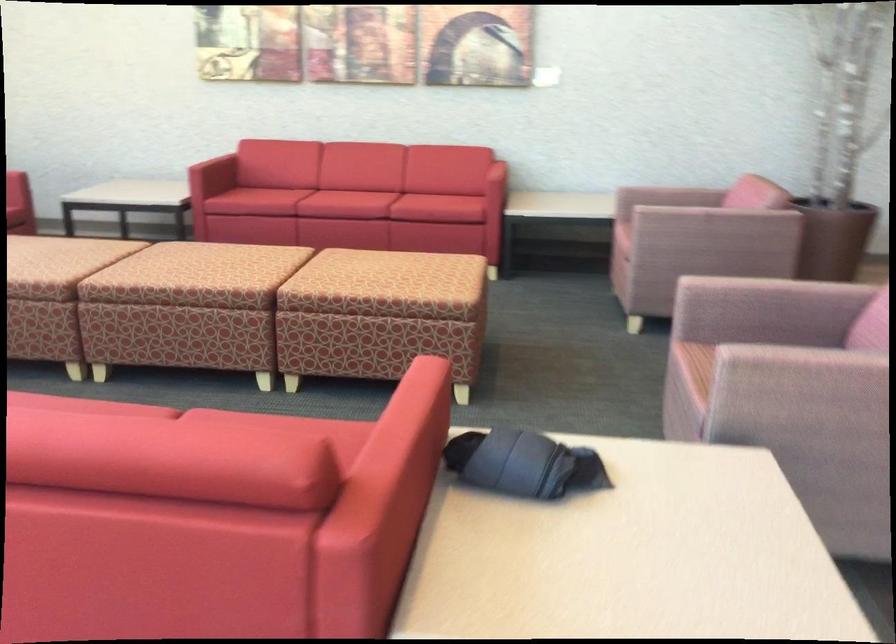
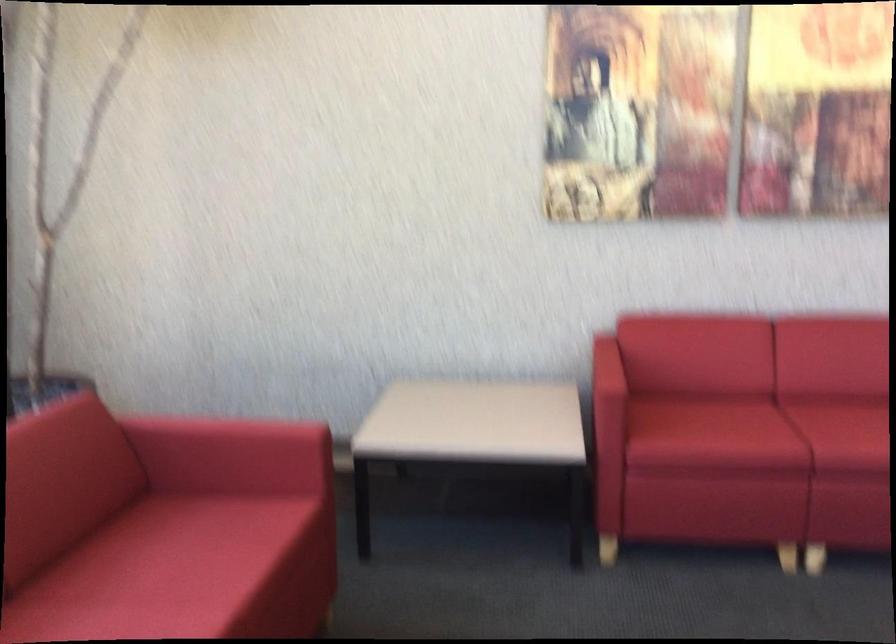
Where in the second image is the point corresponding to (x=277, y=176) from the first image?

(757, 431)